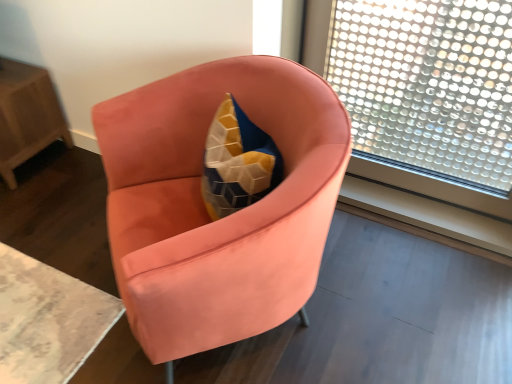
You are a GUI agent. You are given a task and a screenshot of the screen. Output one action in this format:
    pyautogui.click(x=<x>, y=<y>)
    Task: Click on the empty space that is to the right of satin coral armchair at center
    The image size is (512, 384).
    Given the screenshot: What is the action you would take?
    pyautogui.click(x=401, y=297)